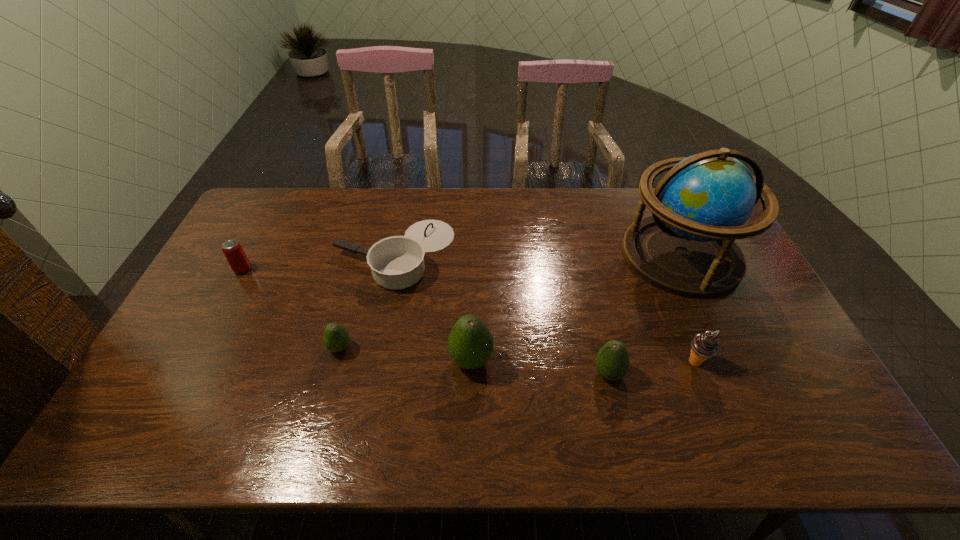
Please point a free position for a avocado on the right. Please provide its 2D coordinates. Your answer should be formatted as a tuple, i.e. [(x, y)], where the tuple contains the x and y coordinates of a point satisfying the conditions above.

[(753, 388)]